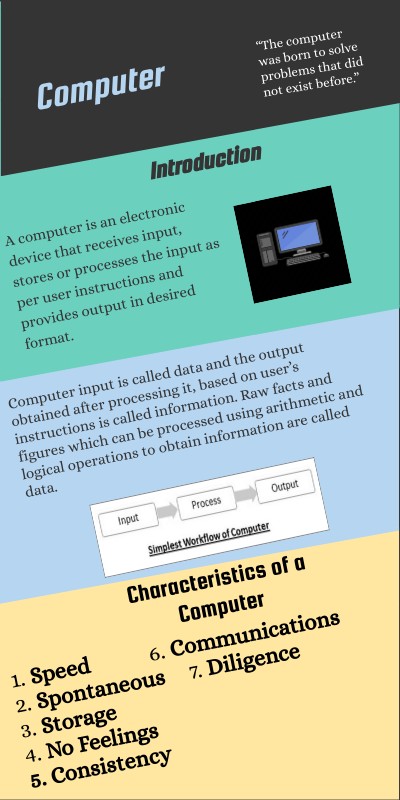
Find the location of a particular element. computer is located at coordinates (303, 229).